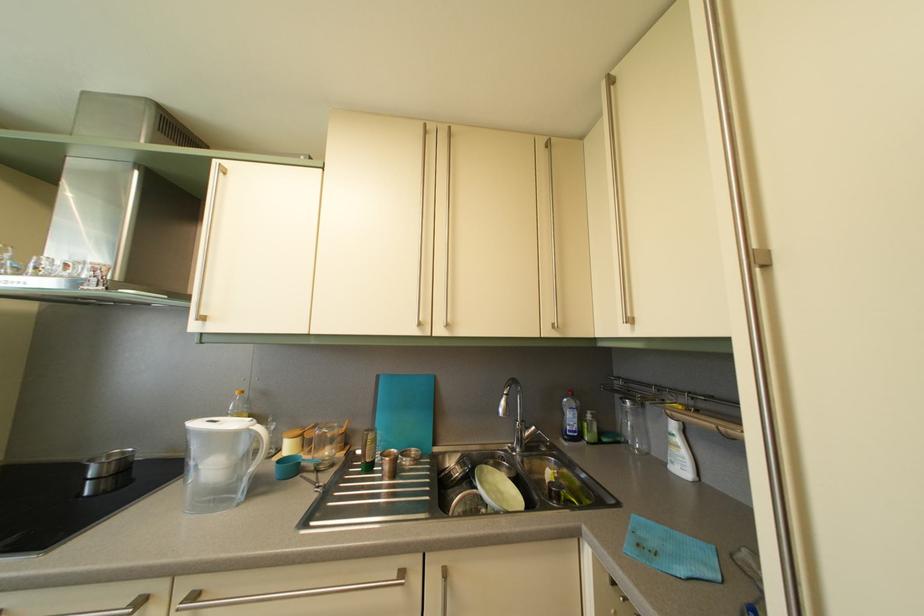
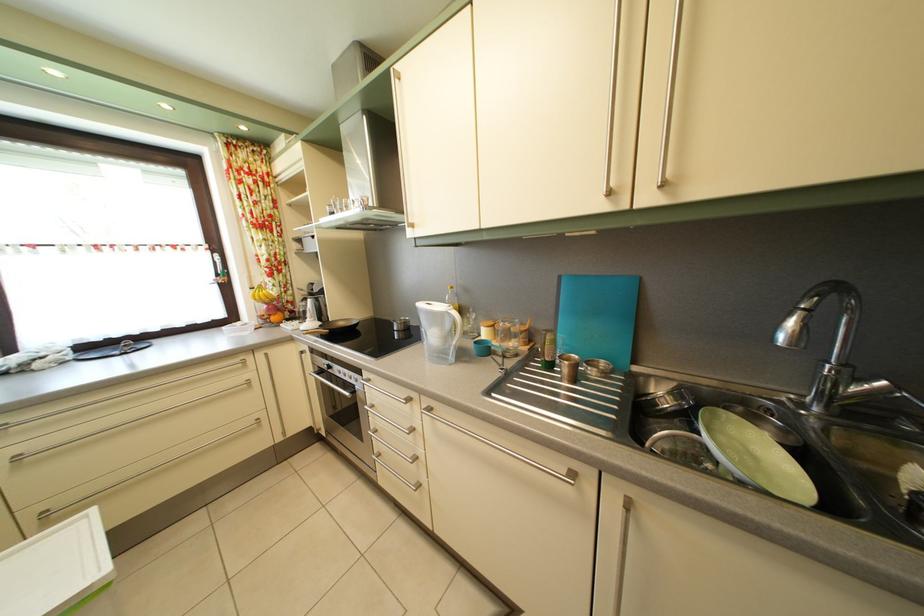
The first image is from the beginning of the video and the second image is from the end. How did the camera likely rotate when shooting the video?

The camera's rotation is toward left-down.